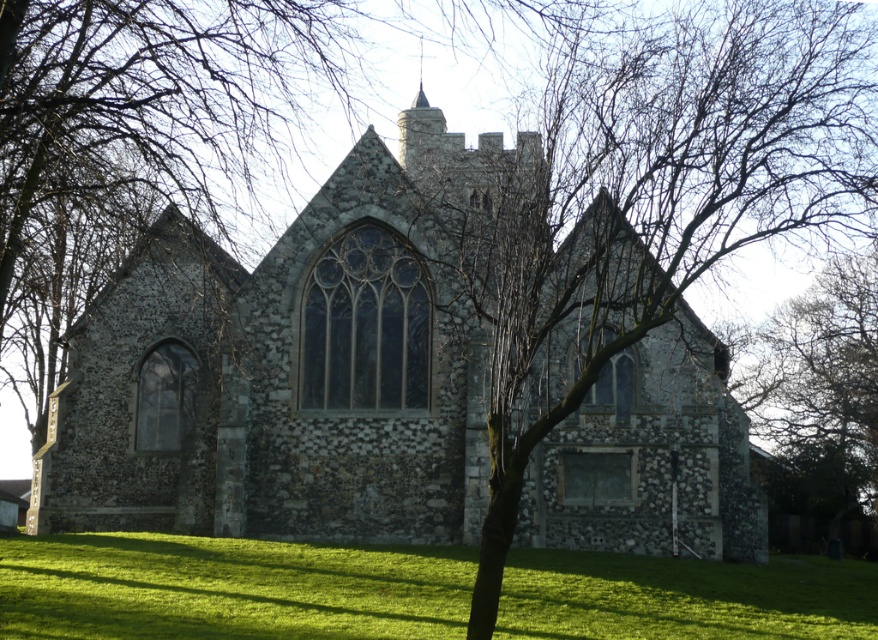
You are standing on the green grass at lower center and want to walk towards the stone church at center. Which direction should you walk to reach it?

Since the stone church at center is positioned over green grass at lower center, you should walk upwards or towards the center to reach it.

You are standing at the entrance of the historic stone church at center. If you walk straight ahead, will you exit the building through the main entrance or end up inside the nave?

The stone church at center is located at point (x=283, y=374), so walking straight ahead from the entrance would take you inside the nave, not back out the main entrance.

You are a photographer planning to take a photo of the stone church at center and the green grass at lower center. Which object should you focus on first if you want to capture both in a single shot without moving the camera?

The stone church at center is much taller than the green grass at lower center, so you should focus on the stone church at center first to ensure its details are captured clearly before the grass.